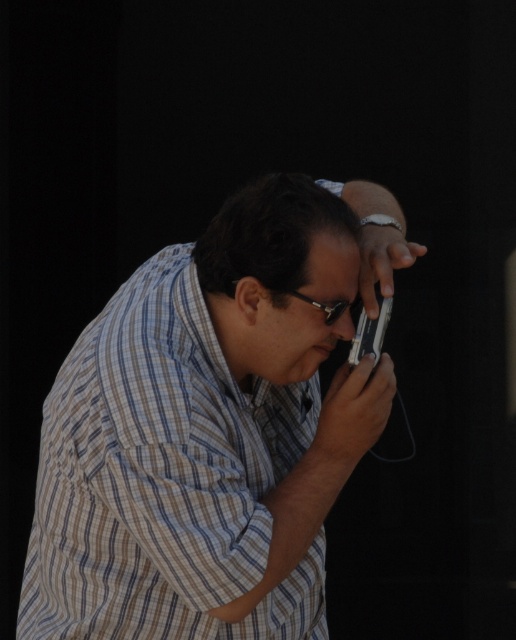
You are a photographer who needs to take a photo of both the striped cotton shirt at center and the sleek silver phone at center. Since the background is dark, you want to ensure both items are visible. Which object should you focus on first to make sure it appears clear in the photo?

The striped cotton shirt at center is in front of the sleek silver phone at center, so you should focus on the striped cotton shirt at center first to ensure it appears clear in the photo.

You are a photographer trying to decide whether to use the striped cotton shirt at center or the sleek silver phone at center as a prop for a closeup shot. Based on their sizes, which object would require more space vertically in the frame?

The striped cotton shirt at center has a greater height compared to the sleek silver phone at center, so it would require more vertical space in the frame.